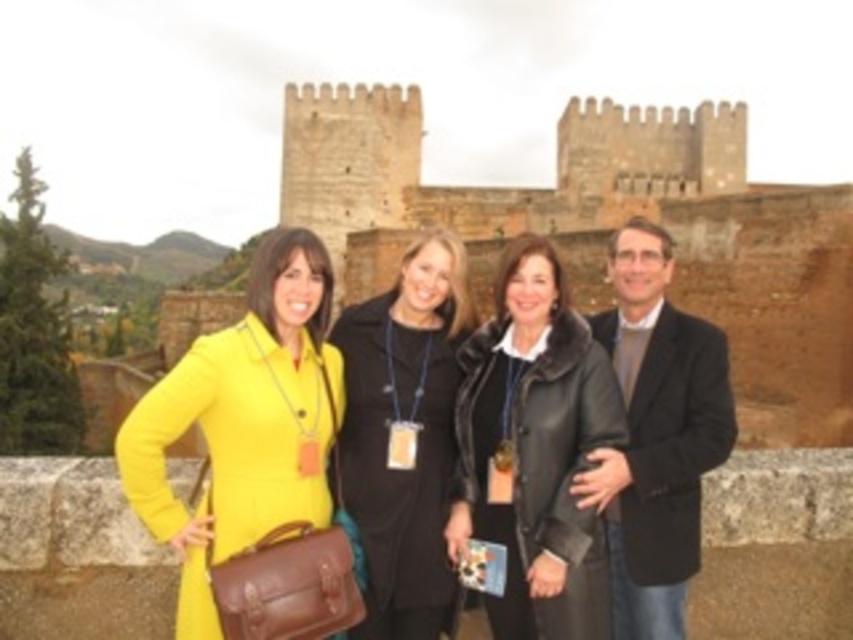
Question: Considering the real-world distances, which object is farthest from the yellow matte coat at center?

Choices:
 (A) black leather coat at center
 (B) matte black coat at center

Answer: (A)

Question: Is yellow matte coat at center bigger than black leather coat at center?

Choices:
 (A) yes
 (B) no

Answer: (A)

Question: Does yellow matte coat at center have a smaller size compared to matte black coat at center?

Choices:
 (A) no
 (B) yes

Answer: (A)

Question: Is black leather coat at center smaller than matte black coat at center?

Choices:
 (A) yes
 (B) no

Answer: (B)

Question: Which point appears closest to the camera in this image?

Choices:
 (A) (628, 264)
 (B) (296, 420)

Answer: (B)

Question: Which point is closer to the camera?

Choices:
 (A) (595, 438)
 (B) (374, 456)
 (C) (248, 502)

Answer: (C)